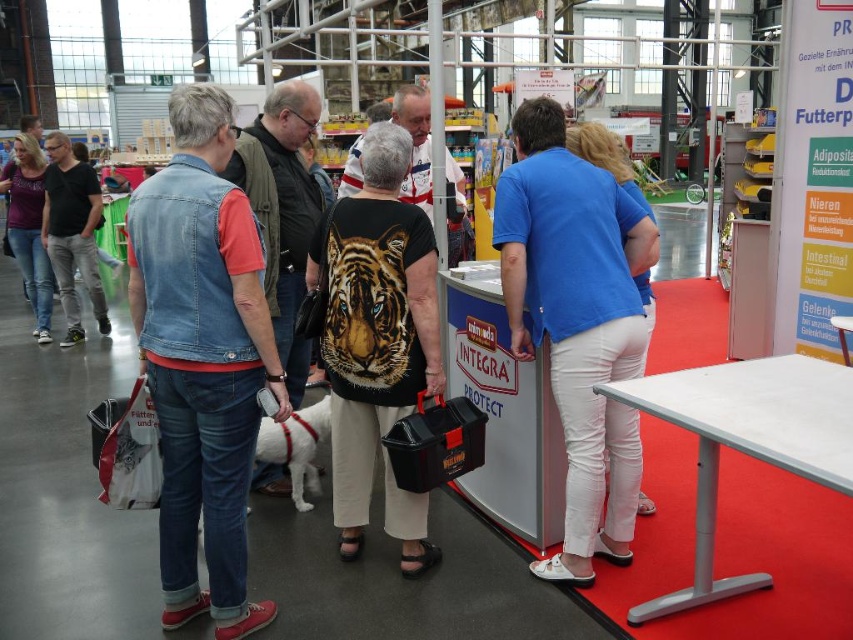
Question: Considering the real-world distances, which object is farthest from the dark gray jeans at left?

Choices:
 (A) white cotton pants at center
 (B) denim jacket at left
 (C) black t-shirt with tiger print at center
 (D) blue cotton shirt at center

Answer: (D)

Question: Which of the following is the farthest from the observer?

Choices:
 (A) (643, 364)
 (B) (170, 422)

Answer: (A)

Question: Does blue cotton shirt at center appear on the right side of white cotton pants at center?

Choices:
 (A) no
 (B) yes

Answer: (A)

Question: Is blue cotton shirt at center below denim jacket at left?

Choices:
 (A) no
 (B) yes

Answer: (B)

Question: In this image, where is denim vest at left located relative to blue cotton shirt at center?

Choices:
 (A) above
 (B) below

Answer: (B)

Question: Estimate the real-world distances between objects in this image. Which object is farther from the white cotton pants at center?

Choices:
 (A) dark gray jeans at left
 (B) denim vest at left
 (C) denim jacket at left

Answer: (A)